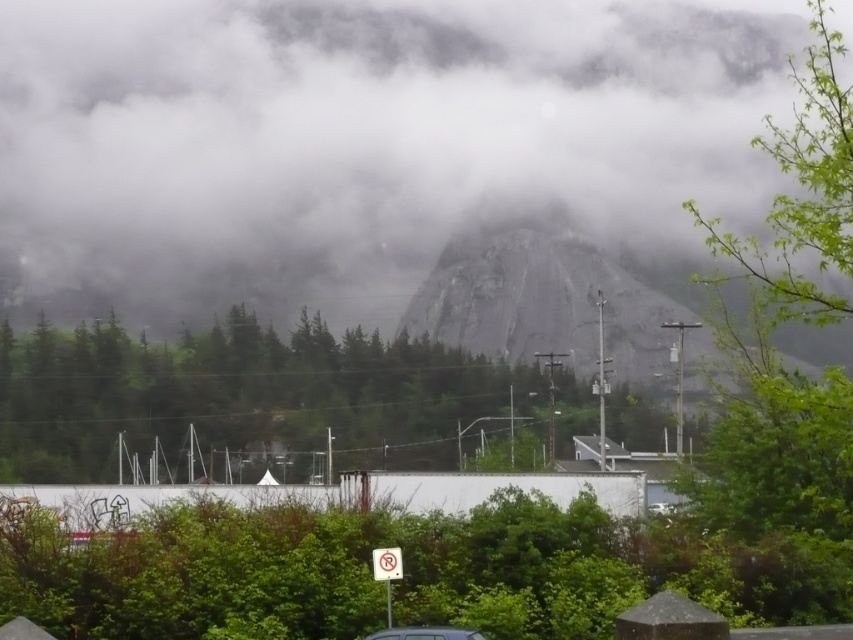
Describe the element at coordinates (360, 141) in the screenshot. I see `white foggy mountain at center` at that location.

Between white foggy mountain at center and green leafy tree at right, which one is positioned lower?

green leafy tree at right is lower down.

Between point (666, 224) and point (775, 410), which one is positioned behind?

The point (666, 224) is more distant.

This screenshot has width=853, height=640. In order to click on white foggy mountain at center in this screenshot , I will do pos(360,141).

Can you confirm if green leafy tree at center is wider than green leafy tree at right?

Yes.

Is point (341, 378) behind point (833, 580)?

Yes, it is behind point (833, 580).

Identify the location of green leafy tree at center. (248, 397).

You are a GUI agent. You are given a task and a screenshot of the screen. Output one action in this format:
    pyautogui.click(x=<x>, y=<y>)
    Task: Click on the green leafy tree at center
    The image size is (853, 640).
    Given the screenshot: What is the action you would take?
    pyautogui.click(x=248, y=397)

Looking at this image, who is more distant from viewer, (354, 397) or (431, 625)?

Positioned behind is point (354, 397).

Who is more distant from viewer, (451,369) or (474,637)?

Positioned behind is point (451,369).

Where is `green leafy tree at center`? Image resolution: width=853 pixels, height=640 pixels. green leafy tree at center is located at coordinates (248, 397).